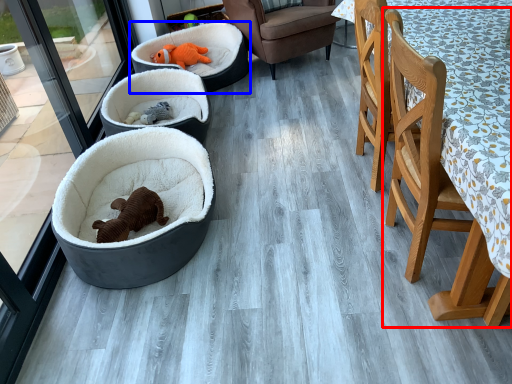
Question: Among these objects, which one is nearest to the camera, chair (highlighted by a red box) or dog bed (highlighted by a blue box)?

Choices:
 (A) chair
 (B) dog bed

Answer: (A)